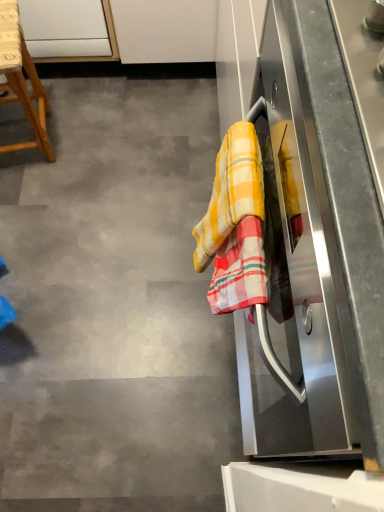
This screenshot has height=512, width=384. In order to click on plaid cotton beach towel at right in this screenshot , I will do `click(240, 271)`.

The width and height of the screenshot is (384, 512). Describe the element at coordinates (231, 192) in the screenshot. I see `yellow checkered towel at right` at that location.

Find the location of a particular element. The width and height of the screenshot is (384, 512). yellow checkered towel at right is located at coordinates (231, 192).

What is the approximate height of yellow checkered towel at right?

0.62 inches.

Describe the element at coordinates (114, 306) in the screenshot. I see `yellow checkered towel at right` at that location.

What are the coordinates of `wooden stool at left` in the screenshot? It's located at (22, 80).

Measure the distance between point (44, 132) and camera.

Point (44, 132) and camera are 5.26 feet apart from each other.

Where is `plaid cotton beach towel at right`? The width and height of the screenshot is (384, 512). plaid cotton beach towel at right is located at coordinates pyautogui.click(x=240, y=271).

Consider the image. Is yellow checkered towel at right positioned far away from plaid cotton beach towel at right?

No, there isn't a large distance between yellow checkered towel at right and plaid cotton beach towel at right.

Identify the location of concrete above the plaid cotton beach towel at right (from the image's perspective). The image size is (384, 512). click(x=114, y=306).

Is yellow checkered towel at right facing towards plaid cotton beach towel at right?

No.

Looking at this image, does yellow checkered towel at right appear on the left side of plaid cotton beach towel at right?

Yes, yellow checkered towel at right is to the left of plaid cotton beach towel at right.

In the scene shown: How different are the orientations of yellow checkered towel at right and wooden stool at left in degrees?

The angle between the facing direction of yellow checkered towel at right and the facing direction of wooden stool at left is 99.9 degrees.

Which of these two, yellow checkered towel at right or wooden stool at left, is smaller?

Smaller between the two is yellow checkered towel at right.

Which is farther, (77, 172) or (41, 123)?

Positioned behind is point (77, 172).

Between yellow checkered towel at right and wooden stool at left, which one appears on the left side from the viewer's perspective?

wooden stool at left.

This screenshot has height=512, width=384. Identify the location of beach towel lying in front of the yellow checkered towel at right. (240, 271).

Would you say plaid cotton beach towel at right is to the left or to the right of yellow checkered towel at right in the picture?

plaid cotton beach towel at right is to the right of yellow checkered towel at right.

Would you say plaid cotton beach towel at right is a long distance from yellow checkered towel at right?

plaid cotton beach towel at right is near yellow checkered towel at right, not far away.

You are a GUI agent. You are given a task and a screenshot of the screen. Output one action in this format:
    pyautogui.click(x=<x>, y=<y>)
    Task: Click on the furniture above the yellow checkered towel at right (from the image's perspective)
    The width and height of the screenshot is (384, 512).
    Given the screenshot: What is the action you would take?
    pyautogui.click(x=22, y=80)

Can you tell me how much wooden stool at left and yellow checkered towel at right differ in facing direction?

The facing directions of wooden stool at left and yellow checkered towel at right are 100 degrees apart.

Can you confirm if wooden stool at left is wider than yellow checkered towel at right?

Correct, the width of wooden stool at left exceeds that of yellow checkered towel at right.

In the scene shown: Is wooden stool at left not close to yellow checkered towel at right?

Yes, wooden stool at left and yellow checkered towel at right are located far from each other.

Does yellow checkered towel at right appear on the right side of wooden stool at left?

Indeed, yellow checkered towel at right is positioned on the right side of wooden stool at left.

How many degrees apart are the facing directions of yellow checkered towel at right and wooden stool at left?

The facing directions of yellow checkered towel at right and wooden stool at left are 100 degrees apart.

Could you tell me if yellow checkered towel at right is facing wooden stool at left?

No, yellow checkered towel at right does not turn towards wooden stool at left.

In the scene shown: From the image's perspective, is yellow checkered towel at right positioned above or below wooden stool at left?

From the image's perspective, yellow checkered towel at right appears below wooden stool at left.

In the scene shown: Can you confirm if yellow checkered towel at right is thinner than stainless steel oven at right?

Yes, yellow checkered towel at right is thinner than stainless steel oven at right.

From a real-world perspective, is yellow checkered towel at right physically above stainless steel oven at right?

Yes, from a real-world perspective, yellow checkered towel at right is over stainless steel oven at right

Does yellow checkered towel at right contain stainless steel oven at right?

That's incorrect, stainless steel oven at right is not inside yellow checkered towel at right.

Relative to wooden stool at left, is stainless steel oven at right in front or behind?

Visually, stainless steel oven at right is located in front of wooden stool at left.

Considering the sizes of objects stainless steel oven at right and wooden stool at left in the image provided, who is taller, stainless steel oven at right or wooden stool at left?

stainless steel oven at right is taller.

Does stainless steel oven at right appear on the right side of wooden stool at left?

Correct, you'll find stainless steel oven at right to the right of wooden stool at left.

How far apart are stainless steel oven at right and wooden stool at left?

stainless steel oven at right is 3.63 feet away from wooden stool at left.

Find the location of a particular element. beach towel lying in front of the yellow checkered towel at right is located at coordinates (240, 271).

What are the coordinates of `concrete to the right of wooden stool at left` in the screenshot? It's located at (114, 306).

Estimate the real-world distances between objects in this image. Which object is further from stainless steel oven at right, wooden stool at left or plaid cotton beach towel at right?

wooden stool at left.

Estimate the real-world distances between objects in this image. Which object is closer to yellow checkered towel at right, stainless steel oven at right or wooden stool at left?

Among the two, wooden stool at left is located nearer to yellow checkered towel at right.

Considering their positions, is wooden stool at left positioned closer to plaid cotton beach towel at right than yellow checkered towel at right?

yellow checkered towel at right lies closer to plaid cotton beach towel at right than the other object.

Looking at this image, estimate the real-world distances between objects in this image. Which object is closer to plaid cotton beach towel at right, yellow checkered towel at right or wooden stool at left?

Based on the image, yellow checkered towel at right appears to be nearer to plaid cotton beach towel at right.

Which object lies further to the anchor point plaid cotton beach towel at right, yellow checkered towel at right or stainless steel oven at right?

yellow checkered towel at right lies further to plaid cotton beach towel at right than the other object.

From the image, which object appears to be farther from plaid cotton beach towel at right, yellow checkered towel at right or wooden stool at left?

wooden stool at left.

From the image, which object appears to be farther from yellow checkered towel at right, wooden stool at left or stainless steel oven at right?

wooden stool at left.

When comparing their distances from yellow checkered towel at right, does plaid cotton beach towel at right or yellow checkered towel at right seem closer?

plaid cotton beach towel at right lies closer to yellow checkered towel at right than the other object.

Locate an element on the screen. The width and height of the screenshot is (384, 512). concrete between wooden stool at left and yellow checkered towel at right is located at coordinates (114, 306).

Identify the location of concrete between wooden stool at left and plaid cotton beach towel at right in the horizontal direction. (114, 306).

I want to click on beach towel situated between wooden stool at left and stainless steel oven at right from left to right, so click(x=240, y=271).

Identify the location of beach towel positioned between stainless steel oven at right and yellow checkered towel at right from near to far. (240, 271).